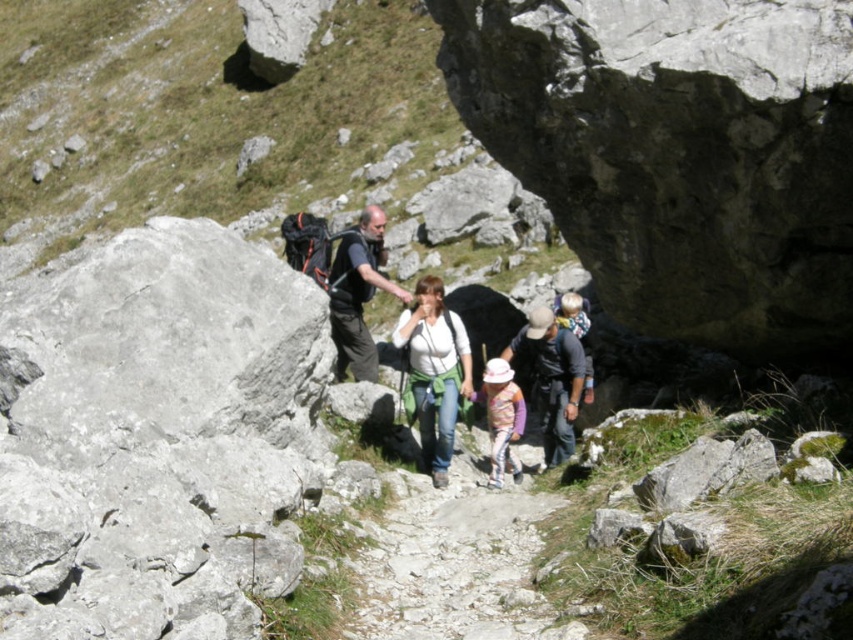
You are a hiker planning to walk along the gray rocky trail at center while carrying the matte black backpack at center. Based on the scene description, can you determine if the trail is wide enough for you to walk comfortably with the backpack?

The gray rocky trail at center is wider than the matte black backpack at center, so yes, the trail is wide enough for you to walk comfortably while carrying the backpack.

You are a hiker planning to take a photo of the gray rocky trail at center from the point at coordinates (453, 564). Is this point located on the gray rocky trail at center?

Yes, the point at coordinates (453, 564) corresponds to the gray rocky trail at center, so the point is located on the gray rocky trail at center.

You are a hiker planning to walk through the rocky terrain shown in the image. You see two backpacks at the center of the scene. Which backpack is positioned lower on the ground between the matte black backpack at center and the dark gray fabric backpack at center?

The matte black backpack at center is located below the dark gray fabric backpack at center, so it is positioned lower on the ground.